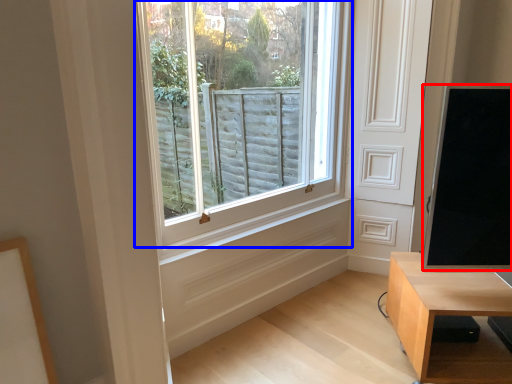
Question: Which of the following is the closest to the observer, window screen (highlighted by a red box) or window (highlighted by a blue box)?

Choices:
 (A) window screen
 (B) window

Answer: (A)